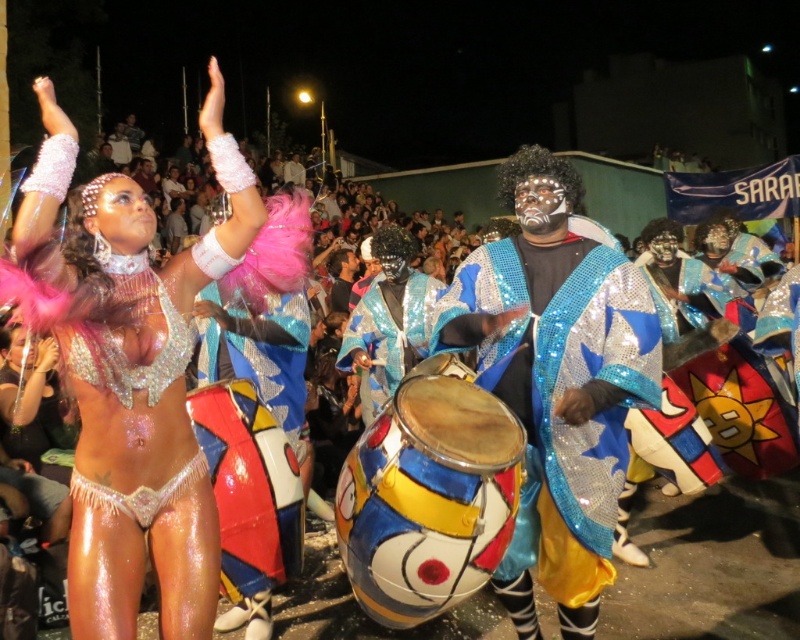
Question: Which point is closer to the camera?

Choices:
 (A) sparkly silver bikini at upper left
 (B) painted fabric drum at center
 (C) painted wood drum at center

Answer: (A)

Question: Is shiny sequined robe at center positioned at the back of shiny sequined cape at center?

Choices:
 (A) no
 (B) yes

Answer: (A)

Question: Which point is farther to the camera?

Choices:
 (A) (652, 307)
 (B) (436, 296)

Answer: (B)

Question: Does sparkly silver bikini at upper left lie behind shiny sequined cape at center?

Choices:
 (A) yes
 (B) no

Answer: (B)

Question: Which of the following is the farthest from the observer?

Choices:
 (A) (501, 257)
 (B) (286, 508)

Answer: (B)

Question: Is sparkly silver bikini at upper left thinner than shiny sequined cape at center?

Choices:
 (A) no
 (B) yes

Answer: (A)